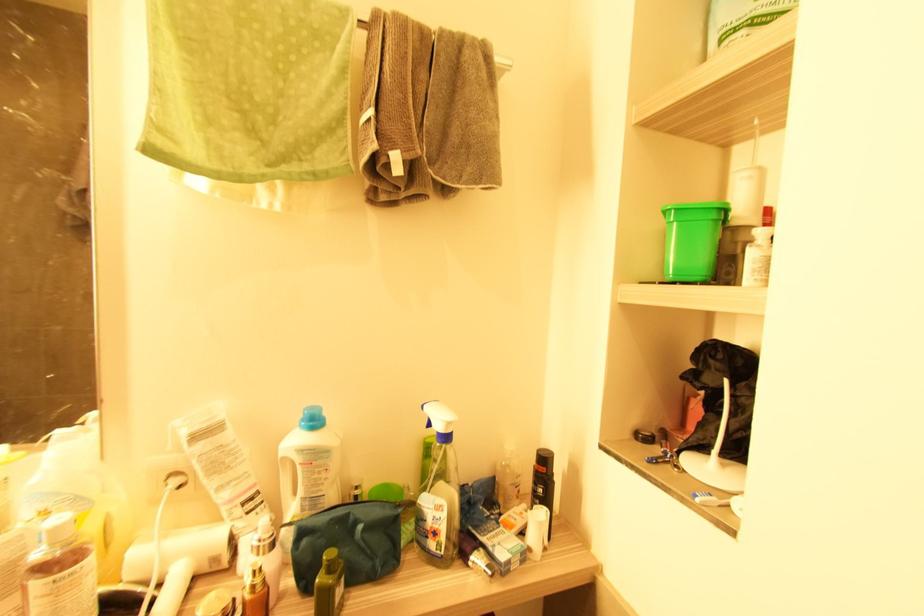
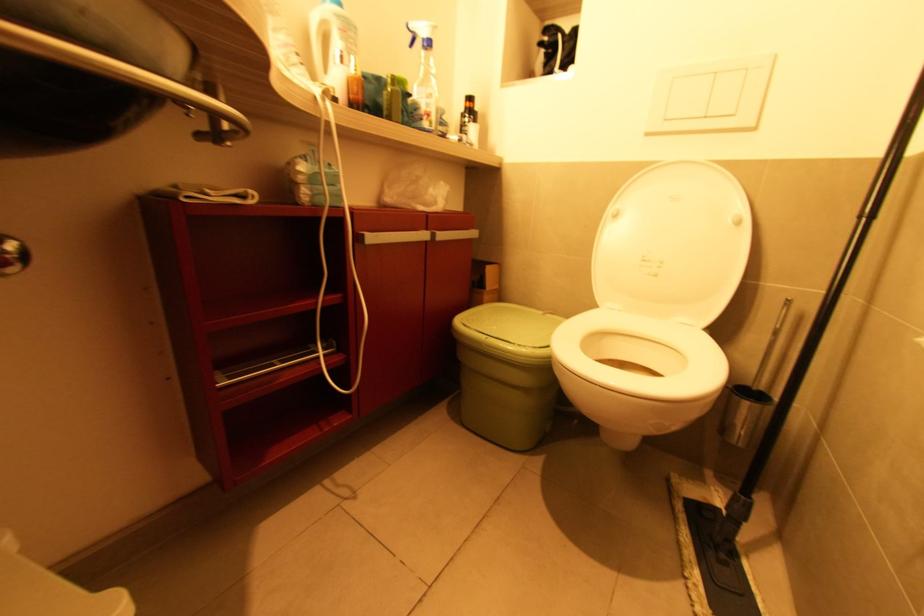
Where in the second image is the point corresponding to point 429,539 from the first image?

(424, 121)